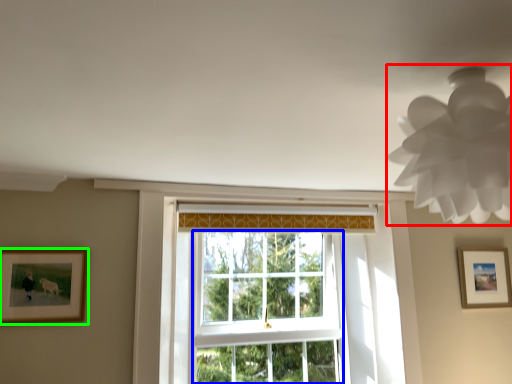
Question: Based on their relative distances, which object is farther from lamp (highlighted by a red box)? Choose from bay window (highlighted by a blue box) and picture frame (highlighted by a green box).

Choices:
 (A) bay window
 (B) picture frame

Answer: (A)